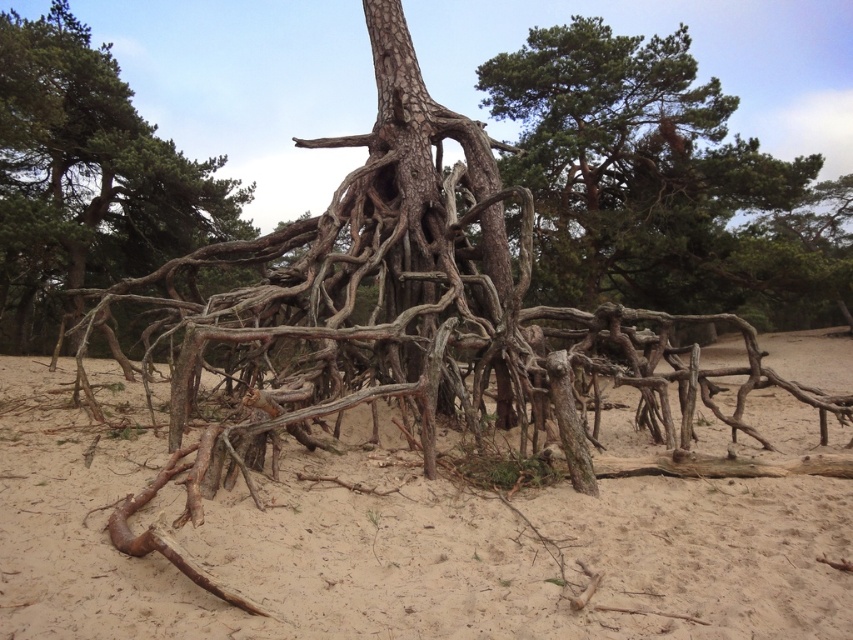
Between point (749, 173) and point (38, 301), which one is positioned in front?

Point (749, 173)

Can you confirm if green textured pine tree at upper center is thinner than brown rough roots at center?

Indeed, green textured pine tree at upper center has a lesser width compared to brown rough roots at center.

What are the coordinates of `green textured pine tree at upper center` in the screenshot? It's located at (643, 173).

Locate an element on the screen. The width and height of the screenshot is (853, 640). green textured pine tree at upper center is located at coordinates (643, 173).

Is brown wood roots at center smaller than green textured pine tree at upper center?

Indeed, brown wood roots at center has a smaller size compared to green textured pine tree at upper center.

Is brown wood roots at center bigger than green textured pine tree at upper center?

No, brown wood roots at center is not bigger than green textured pine tree at upper center.

The image size is (853, 640). What are the coordinates of `brown wood roots at center` in the screenshot? It's located at (404, 547).

At what (x,y) coordinates should I click in order to perform the action: click on brown wood roots at center. Please return your answer as a coordinate pair (x, y). The height and width of the screenshot is (640, 853). Looking at the image, I should click on (404, 547).

Does brown wood roots at center have a greater height compared to brown rough roots at center?

No, brown wood roots at center is not taller than brown rough roots at center.

Is the position of brown wood roots at center less distant than that of brown rough roots at center?

Yes.

Is point (473, 518) positioned before point (157, 157)?

Yes, it is in front of point (157, 157).

Image resolution: width=853 pixels, height=640 pixels. I want to click on brown wood roots at center, so [404, 547].